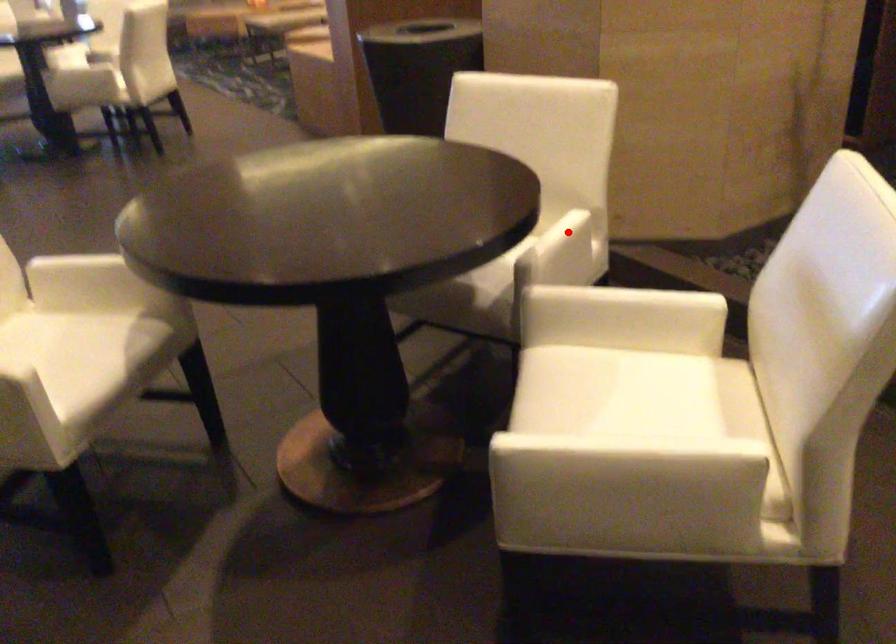
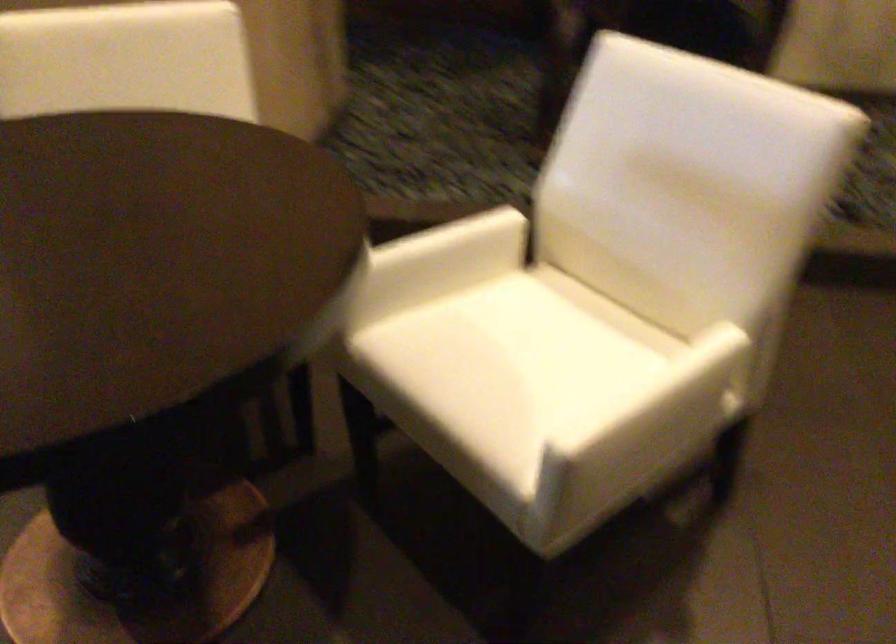
Question: I am providing you with two images of the same scene from different viewpoints. A red point is marked on the first image. Can you still see the location of the red point in image 2?

Choices:
 (A) Yes
 (B) No

Answer: (B)